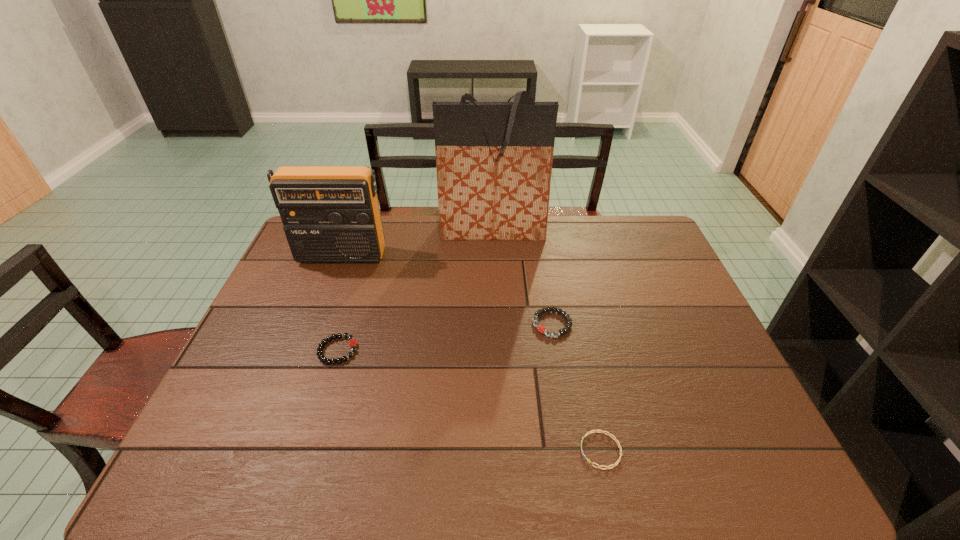
Locate an element on the screen. This screenshot has height=540, width=960. free space between the shortest object and the second tallest object is located at coordinates (471, 353).

At what (x,y) coordinates should I click in order to perform the action: click on vacant area between the nearest object and the leftmost bracelet. Please return your answer as a coordinate pair (x, y). Image resolution: width=960 pixels, height=540 pixels. Looking at the image, I should click on (469, 400).

This screenshot has height=540, width=960. I want to click on free space between the shopping bag and the second tallest object, so click(417, 244).

You are a GUI agent. You are given a task and a screenshot of the screen. Output one action in this format:
    pyautogui.click(x=<x>, y=<y>)
    Task: Click on the empty space between the tallest object and the radio receiver
    This screenshot has height=540, width=960.
    Given the screenshot: What is the action you would take?
    pyautogui.click(x=417, y=244)

The image size is (960, 540). What are the coordinates of `object that is the fourth closest one to the nearest object` in the screenshot? It's located at (330, 214).

Choose which object is the nearest neighbor to the shortest bracelet. Please provide its 2D coordinates. Your answer should be formatted as a tuple, i.e. [(x, y)], where the tuple contains the x and y coordinates of a point satisfying the conditions above.

[(540, 328)]

Image resolution: width=960 pixels, height=540 pixels. What are the coordinates of `bracelet that is the second closest one to the nearest bracelet` in the screenshot? It's located at (353, 343).

This screenshot has width=960, height=540. In order to click on bracelet that is the second closest to the shortest bracelet in this screenshot , I will do `click(353, 343)`.